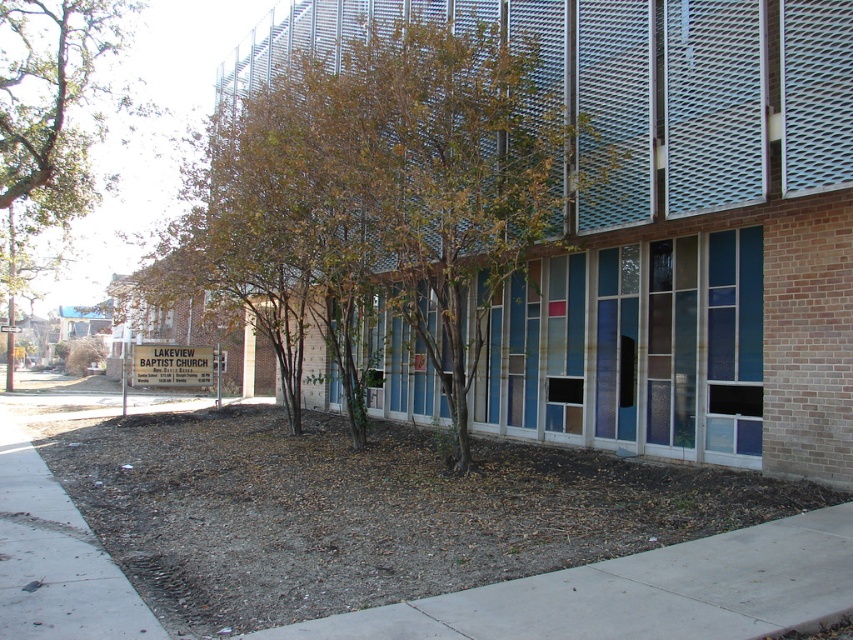
Question: Among these points, which one is farthest from the camera?

Choices:
 (A) (25, 26)
 (B) (828, 545)
 (C) (251, 195)
 (D) (440, 618)

Answer: (A)

Question: Estimate the real-world distances between objects in this image. Which object is farther from the brown leafy tree at left?

Choices:
 (A) green leafy tree at center
 (B) gray concrete sidewalk at lower center
 (C) concrete sidewalk at center

Answer: (B)

Question: Is the position of green leafy tree at center more distant than that of gray concrete sidewalk at lower center?

Choices:
 (A) yes
 (B) no

Answer: (A)

Question: Is green leafy tree at center positioned behind gray concrete sidewalk at lower center?

Choices:
 (A) no
 (B) yes

Answer: (B)

Question: Estimate the real-world distances between objects in this image. Which object is closer to the concrete sidewalk at center?

Choices:
 (A) brown leafy tree at left
 (B) green leafy tree at center

Answer: (B)

Question: Can you confirm if green leafy tree at center is positioned below gray concrete sidewalk at lower center?

Choices:
 (A) no
 (B) yes

Answer: (A)